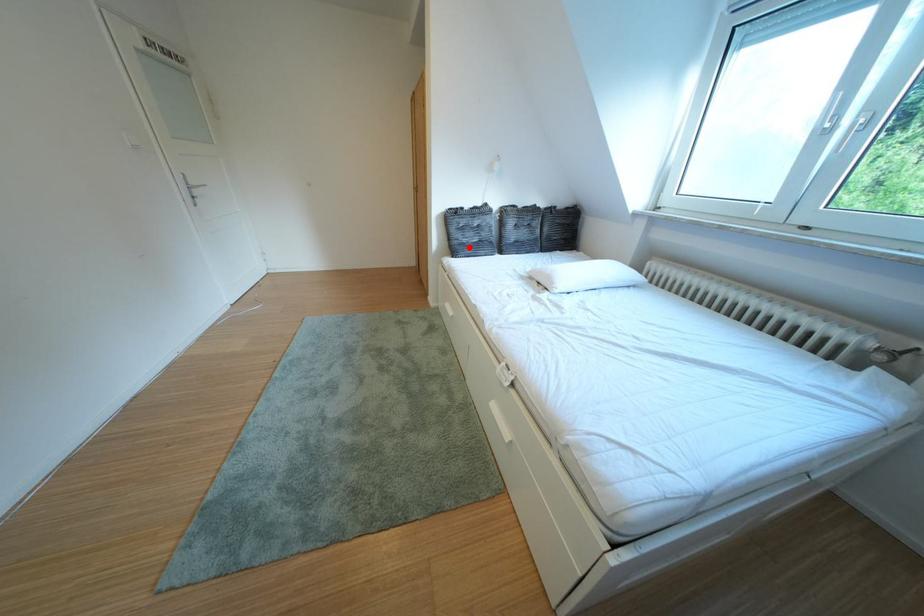
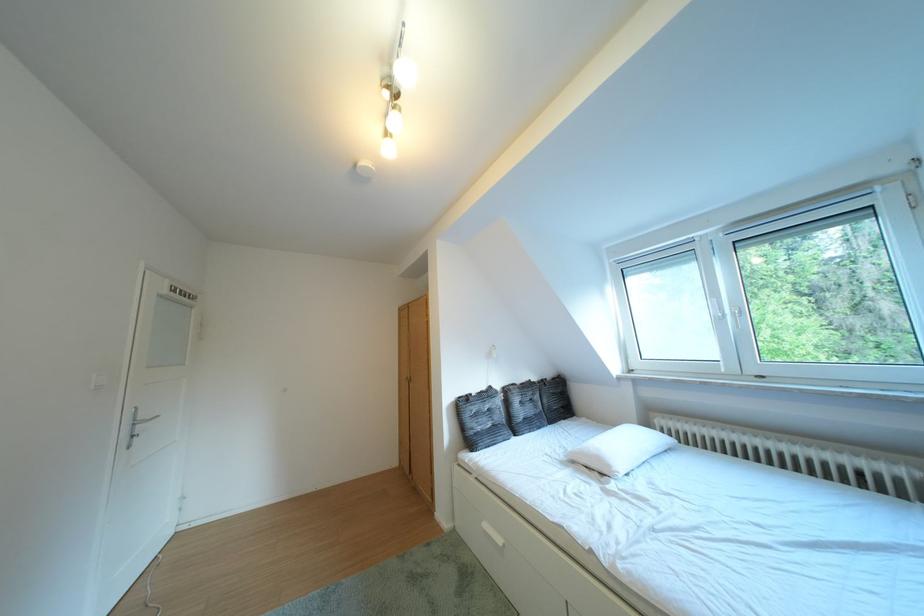
Find the pixel in the second image that matches the highlighted location in the first image.

(484, 438)